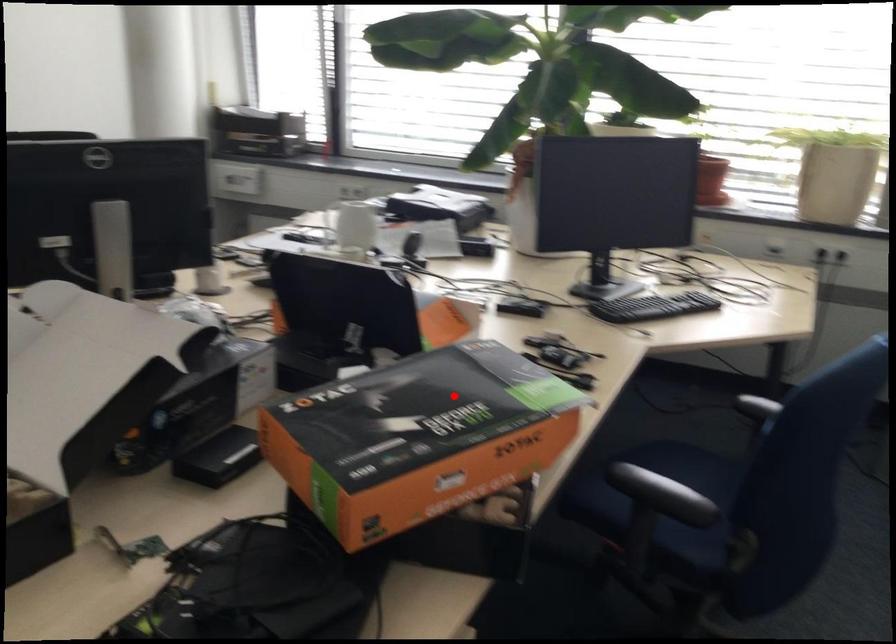
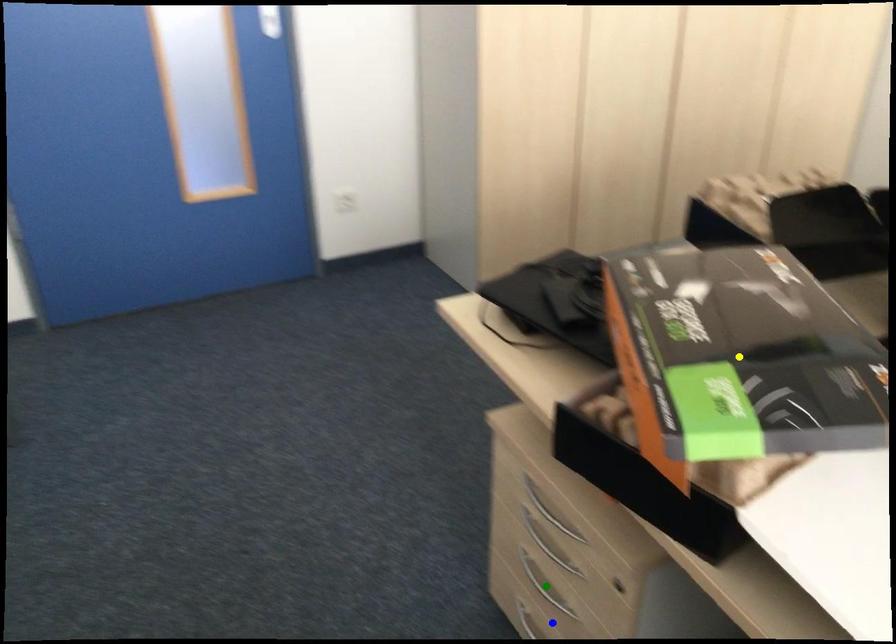
Question: I am providing you with two images of the same scene from different viewpoints. A red point is marked on the first image. You are given multiple points on the second image. In image 2, which mark is for the same physical point as the one in image 1?

Choices:
 (A) blue point
 (B) green point
 (C) yellow point

Answer: (C)